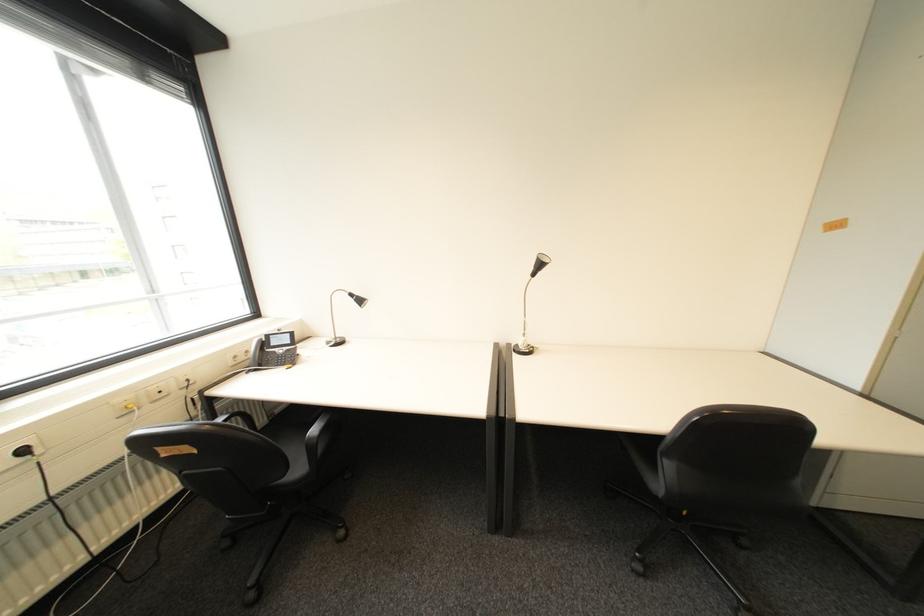
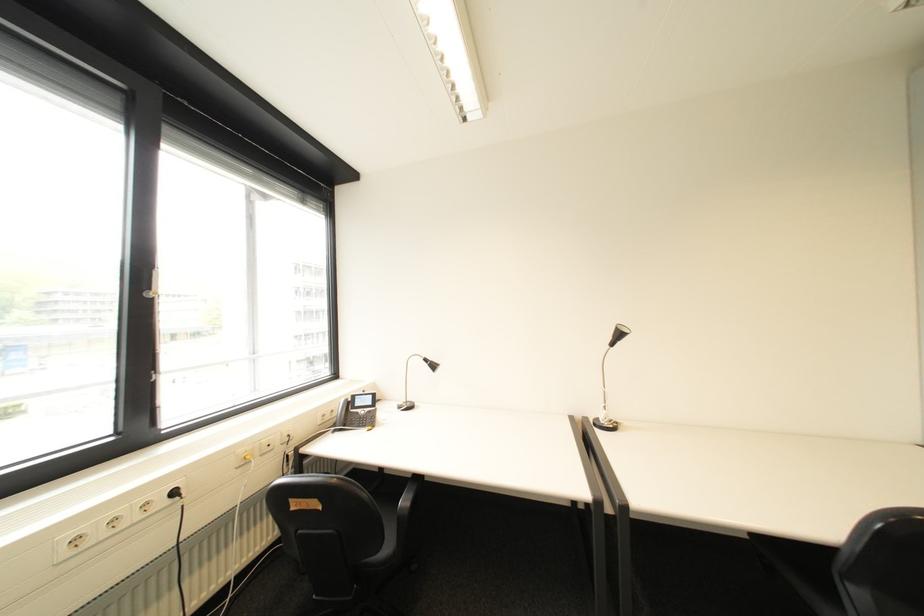
Question: How did the camera likely rotate?

Choices:
 (A) Left
 (B) Right
 (C) Up
 (D) Down

Answer: (C)